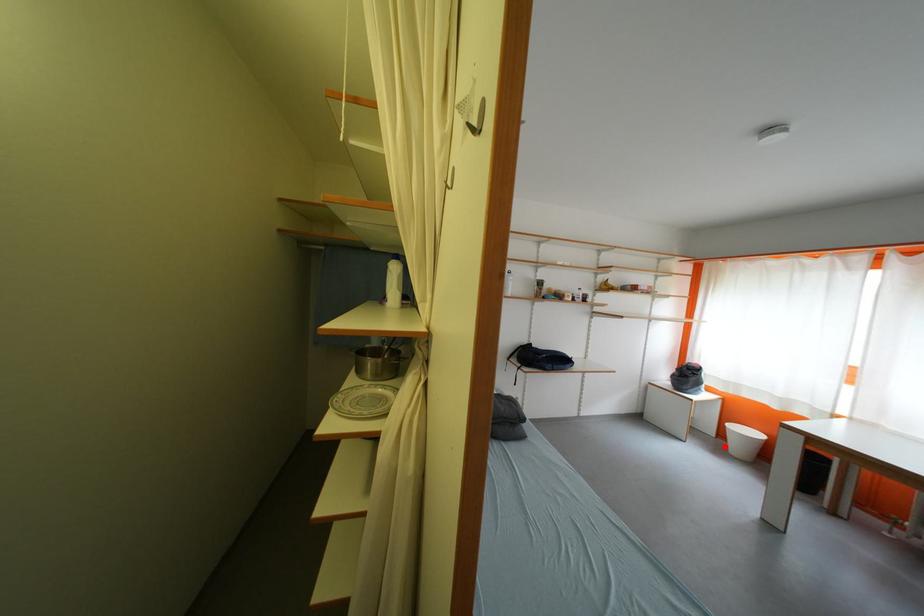
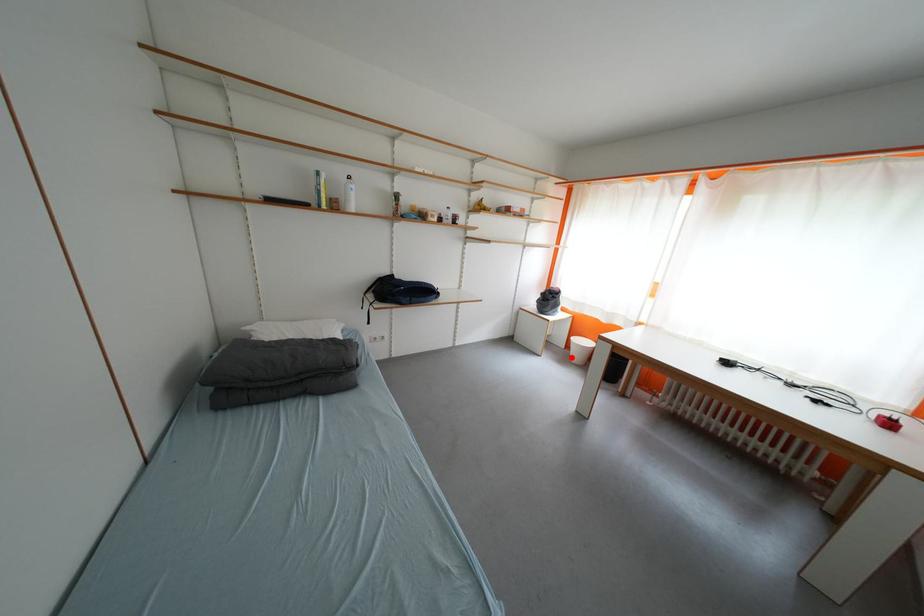
From the picture: I am providing you with two images of the same scene from different viewpoints. A red point is marked on the first image and another point is marked on the second image. Is the marked point in image1 the same physical position as the marked point in image2?

Yes